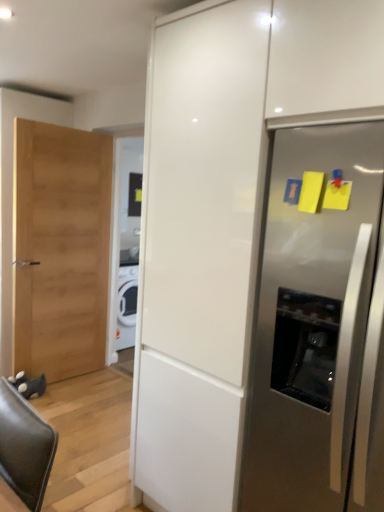
What do you see at coordinates (262, 256) in the screenshot?
I see `white glossy cabinet at center` at bounding box center [262, 256].

The image size is (384, 512). Identify the location of white glossy cabinet at center. (262, 256).

The width and height of the screenshot is (384, 512). What are the coordinates of `stainless steel refrigerator at right` in the screenshot? It's located at (312, 316).

What do you see at coordinates (312, 316) in the screenshot?
I see `stainless steel refrigerator at right` at bounding box center [312, 316].

Where is `white glossy cabinet at center`? The width and height of the screenshot is (384, 512). white glossy cabinet at center is located at coordinates (262, 256).

Which is more to the left, stainless steel refrigerator at right or white glossy cabinet at center?

white glossy cabinet at center is more to the left.

In the image, is stainless steel refrigerator at right positioned in front of or behind white glossy cabinet at center?

Clearly, stainless steel refrigerator at right is behind white glossy cabinet at center.

Considering the points (301, 481) and (208, 358), which point is in front, point (301, 481) or point (208, 358)?

Positioned in front is point (301, 481).

Consider the image. From the image's perspective, would you say stainless steel refrigerator at right is shown under white glossy cabinet at center?

Yes, from the image's perspective, stainless steel refrigerator at right is below white glossy cabinet at center.

From a real-world perspective, is stainless steel refrigerator at right positioned over white glossy cabinet at center based on gravity?

No, from a real-world perspective, stainless steel refrigerator at right is not above white glossy cabinet at center.

Between stainless steel refrigerator at right and white glossy cabinet at center, which one has smaller width?

With smaller width is white glossy cabinet at center.

Considering the sizes of objects stainless steel refrigerator at right and white glossy cabinet at center in the image provided, who is taller, stainless steel refrigerator at right or white glossy cabinet at center?

Standing taller between the two is white glossy cabinet at center.

Does stainless steel refrigerator at right have a smaller size compared to white glossy cabinet at center?

Correct, stainless steel refrigerator at right occupies less space than white glossy cabinet at center.

Could white glossy cabinet at center be considered to be inside stainless steel refrigerator at right?

Indeed, white glossy cabinet at center is located within stainless steel refrigerator at right.

Based on the photo, is stainless steel refrigerator at right directly adjacent to white glossy cabinet at center?

No.

Could you tell me if stainless steel refrigerator at right is facing white glossy cabinet at center?

Yes, stainless steel refrigerator at right is turned towards white glossy cabinet at center.

Where is `cabinetry above the stainless steel refrigerator at right (from the image's perspective)`? This screenshot has width=384, height=512. cabinetry above the stainless steel refrigerator at right (from the image's perspective) is located at coordinates (262, 256).

Can you confirm if white glossy cabinet at center is positioned to the right of stainless steel refrigerator at right?

No.

In the image, is white glossy cabinet at center positioned in front of or behind stainless steel refrigerator at right?

white glossy cabinet at center is in front of stainless steel refrigerator at right.

Does point (163, 403) lie in front of point (296, 500)?

No, it is behind (296, 500).

From the image's perspective, between white glossy cabinet at center and stainless steel refrigerator at right, which one is located above?

white glossy cabinet at center, from the image's perspective.

From a real-world perspective, is white glossy cabinet at center physically located above or below stainless steel refrigerator at right?

In terms of real-world spatial position, white glossy cabinet at center is above stainless steel refrigerator at right.

Is white glossy cabinet at center thinner than stainless steel refrigerator at right?

Indeed, white glossy cabinet at center has a lesser width compared to stainless steel refrigerator at right.

Considering the sizes of objects white glossy cabinet at center and stainless steel refrigerator at right in the image provided, who is shorter, white glossy cabinet at center or stainless steel refrigerator at right?

Standing shorter between the two is stainless steel refrigerator at right.

Who is smaller, white glossy cabinet at center or stainless steel refrigerator at right?

Smaller between the two is stainless steel refrigerator at right.

Is white glossy cabinet at center not within stainless steel refrigerator at right?

No.

Are white glossy cabinet at center and stainless steel refrigerator at right far apart?

Actually, white glossy cabinet at center and stainless steel refrigerator at right are a little close together.

Could you tell me if white glossy cabinet at center is turned towards stainless steel refrigerator at right?

Yes, white glossy cabinet at center faces towards stainless steel refrigerator at right.

In the image, there is a white glossy cabinet at center. Identify the location of refrigerator below it (from the image's perspective). The width and height of the screenshot is (384, 512). (312, 316).

Where is `cabinetry that is above the stainless steel refrigerator at right (from the image's perspective)`? cabinetry that is above the stainless steel refrigerator at right (from the image's perspective) is located at coordinates (262, 256).

Locate an element on the screen. This screenshot has height=512, width=384. refrigerator behind the white glossy cabinet at center is located at coordinates (312, 316).